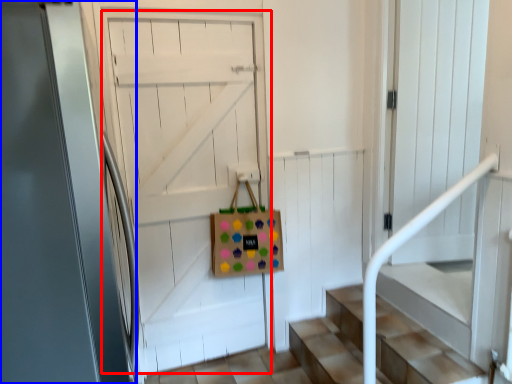
Question: Which object appears farthest to the camera in this image, door (highlighted by a red box) or door (highlighted by a blue box)?

Choices:
 (A) door
 (B) door

Answer: (A)